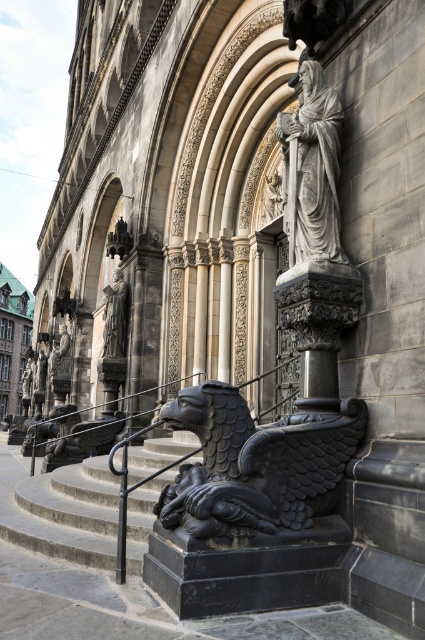
Is point (237, 392) farther from camera compared to point (308, 257)?

No, (237, 392) is in front of (308, 257).

Is point (333, 445) positioned behind point (333, 234)?

No.

The width and height of the screenshot is (425, 640). Find the location of `black stone gargoyle at center`. black stone gargoyle at center is located at coordinates (255, 464).

Does black stone stairs at lower left come behind gray stone statue at upper right?

No, black stone stairs at lower left is closer to the viewer.

What do you see at coordinates (68, 513) in the screenshot? I see `black stone stairs at lower left` at bounding box center [68, 513].

Which is in front, point (107, 477) or point (302, 129)?

Point (302, 129) is more forward.

You are a GUI agent. You are given a task and a screenshot of the screen. Output one action in this format:
    pyautogui.click(x=<x>, y=<y>)
    Task: Click on the black stone stairs at lower left
    This screenshot has width=425, height=640.
    Given the screenshot: What is the action you would take?
    pyautogui.click(x=68, y=513)

Which is above, black stone gargoyle at center or black stone stairs at lower left?

Answer: black stone gargoyle at center is higher up.

Is point (241, 413) closer to viewer compared to point (96, 477)?

Yes, it is in front of point (96, 477).

Who is more forward, (226, 525) or (53, 541)?

Point (226, 525) is in front.

Identify the location of black stone gargoyle at center. The width and height of the screenshot is (425, 640). (255, 464).